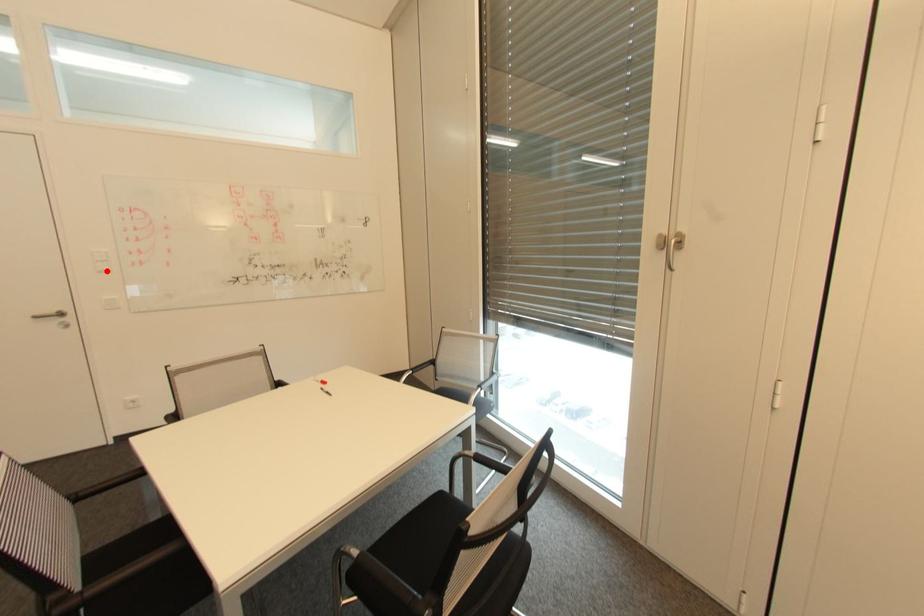
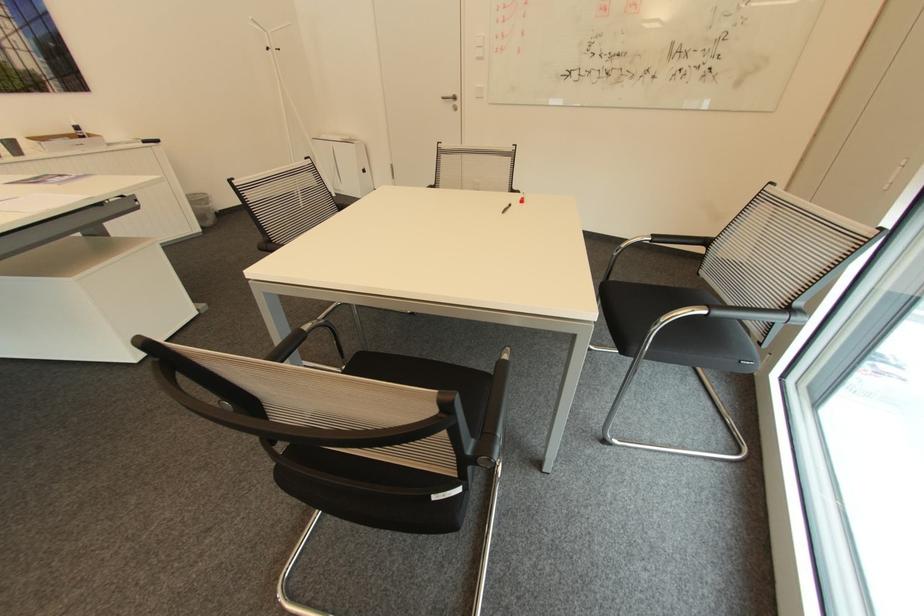
Question: I am providing you with two images of the same scene from different viewpoints. A red point is shown in image1. For the corresponding object point in image2, is it positioned nearer or farther from the camera?

Choices:
 (A) Nearer
 (B) Farther

Answer: (A)